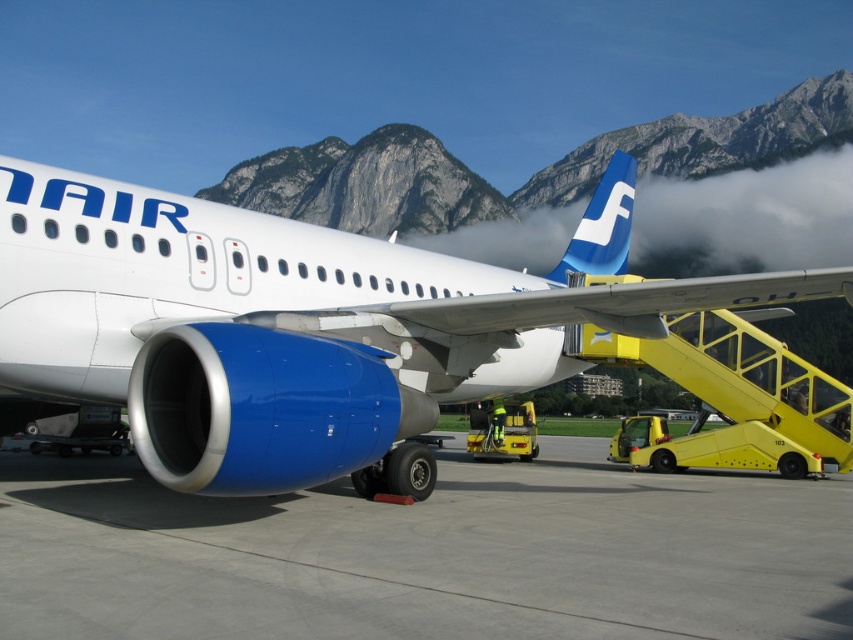
Is gray concrete tarmac at lower center taller than blue matte tail at upper center?

Incorrect, gray concrete tarmac at lower center's height is not larger of blue matte tail at upper center's.

Is gray concrete tarmac at lower center thinner than blue matte tail at upper center?

Yes.

Does point (1, 544) come closer to viewer compared to point (618, 166)?

Yes.

I want to click on gray concrete tarmac at lower center, so click(x=428, y=554).

Does point (49, 180) lie in front of point (361, 596)?

No, it is not.

Between blue metallic airplane at center and gray concrete tarmac at lower center, which one appears on the right side from the viewer's perspective?

Positioned to the right is blue metallic airplane at center.

I want to click on blue metallic airplane at center, so click(x=285, y=326).

Does blue metallic airplane at center come in front of blue matte tail at upper center?

Yes.

Between blue metallic airplane at center and blue matte tail at upper center, which one is positioned higher?

blue matte tail at upper center is above.

Is point (469, 275) positioned before point (572, 269)?

Yes, it is in front of point (572, 269).

The width and height of the screenshot is (853, 640). In order to click on blue metallic airplane at center in this screenshot , I will do `click(285, 326)`.